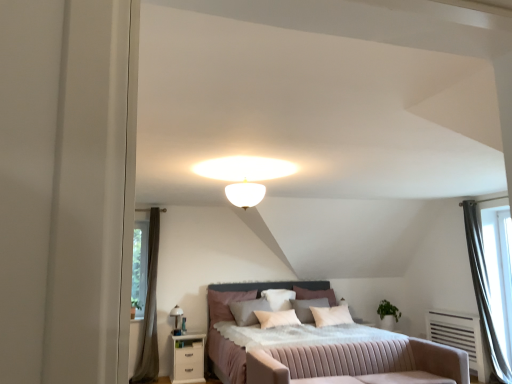
This screenshot has height=384, width=512. What do you see at coordinates (225, 303) in the screenshot?
I see `velvet-like pink pillow at center, the 3th pillow viewed from the right` at bounding box center [225, 303].

Measure the distance between point (177,321) and camera.

5.91 meters.

This screenshot has height=384, width=512. What do you see at coordinates (279, 298) in the screenshot? I see `white soft pillow at center, acting as the 2th pillow starting from the left` at bounding box center [279, 298].

Find the location of a particular element. The image size is (512, 384). soft pink pillow at center, which is the third pillow from left to right is located at coordinates (315, 294).

Which is closer to the camera, (490, 329) or (305, 285)?

The point (490, 329) is more forward.

Do you think silvery metallic curtain at right, which is counted as the second curtain, starting from the left, is within pink fabric bed at center, or outside of it?

The correct answer is: outside.

The height and width of the screenshot is (384, 512). What are the coordinates of `bed below the silvery metallic curtain at right, which is counted as the second curtain, starting from the left (from a real-world perspective)` in the screenshot? It's located at (321, 350).

Is silvery metallic curtain at right, which is counted as the second curtain, starting from the left, aimed at pink fabric bed at center?

Yes, silvery metallic curtain at right, which is counted as the second curtain, starting from the left, faces towards pink fabric bed at center.

Is white soft pillow at center, acting as the 2th pillow starting from the left, not close to pink fabric bed at center?

That's right, there is a large distance between white soft pillow at center, acting as the 2th pillow starting from the left, and pink fabric bed at center.

In the scene shown: Does white soft pillow at center, acting as the 2th pillow starting from the left, appear on the right side of pink fabric bed at center?

No, white soft pillow at center, acting as the 2th pillow starting from the left, is not to the right of pink fabric bed at center.

Based on the photo, does white soft pillow at center, which is counted as the second pillow, starting from the right, have a greater width compared to pink fabric bed at center?

No.

Which of these two, white soft pillow at center, acting as the 2th pillow starting from the left, or white glossy nightstand at lower left, is bigger?

white glossy nightstand at lower left is bigger.

Locate an element on the screen. nightstand below the white soft pillow at center, which is counted as the second pillow, starting from the right (from a real-world perspective) is located at coordinates (187, 359).

In terms of width, does white soft pillow at center, which is counted as the second pillow, starting from the right, look wider or thinner when compared to white glossy nightstand at lower left?

white soft pillow at center, which is counted as the second pillow, starting from the right, is thinner than white glossy nightstand at lower left.

Are soft pink pillow at center, which is the third pillow from left to right, and silvery metallic curtain at right, which is counted as the second curtain, starting from the left, beside each other?

There is a gap between soft pink pillow at center, which is the third pillow from left to right, and silvery metallic curtain at right, which is counted as the second curtain, starting from the left.

From the image's perspective, would you say soft pink pillow at center, which is the third pillow from left to right, is shown under silvery metallic curtain at right, which is the 1th curtain in right-to-left order?

Indeed, from the image's perspective, soft pink pillow at center, which is the third pillow from left to right, is shown beneath silvery metallic curtain at right, which is the 1th curtain in right-to-left order.

Based on the photo, does soft pink pillow at center, which is the third pillow from left to right, turn towards silvery metallic curtain at right, which is the 1th curtain in right-to-left order?

A: No, soft pink pillow at center, which is the third pillow from left to right, does not turn towards silvery metallic curtain at right, which is the 1th curtain in right-to-left order.

Based on the photo, in the image, is soft pink pillow at center, the 1th pillow positioned from the right, on the left side or the right side of silvery metallic curtain at right, which is counted as the second curtain, starting from the left?

soft pink pillow at center, the 1th pillow positioned from the right, is positioned on silvery metallic curtain at right, which is counted as the second curtain, starting from the left,'s left side.

Considering the positions of objects white glossy nightstand at lower left and soft pink pillow at center, the 1th pillow positioned from the right, in the image provided, who is more to the right, white glossy nightstand at lower left or soft pink pillow at center, the 1th pillow positioned from the right,?

Positioned to the right is soft pink pillow at center, the 1th pillow positioned from the right.

From a real-world perspective, is white glossy nightstand at lower left below soft pink pillow at center, the 1th pillow positioned from the right?

Yes.

From the image's perspective, which one is positioned higher, white glossy nightstand at lower left or soft pink pillow at center, the 1th pillow positioned from the right?

soft pink pillow at center, the 1th pillow positioned from the right, is shown above in the image.

Which of these two, brown fabric curtain at left, which is counted as the 2th curtain, starting from the right, or velvet-like pink pillow at center, which is the first pillow from left to right, stands shorter?

With less height is velvet-like pink pillow at center, which is the first pillow from left to right.

From a real-world perspective, is brown fabric curtain at left, which is counted as the 2th curtain, starting from the right, physically below velvet-like pink pillow at center, the 3th pillow viewed from the right?

No.

From the image's perspective, is brown fabric curtain at left, which is counted as the 2th curtain, starting from the right, on velvet-like pink pillow at center, the 3th pillow viewed from the right?

Yes, from the image's perspective, brown fabric curtain at left, which is counted as the 2th curtain, starting from the right, is above velvet-like pink pillow at center, the 3th pillow viewed from the right.

Is brown fabric curtain at left, which is counted as the 2th curtain, starting from the right, turned away from velvet-like pink pillow at center, the 3th pillow viewed from the right?

No, velvet-like pink pillow at center, the 3th pillow viewed from the right, is not at the back of brown fabric curtain at left, which is counted as the 2th curtain, starting from the right.

Considering the relative sizes of soft pink pillow at center, the 1th pillow positioned from the right, and velvet-like pink pillow at center, which is the first pillow from left to right, in the image provided, is soft pink pillow at center, the 1th pillow positioned from the right, bigger than velvet-like pink pillow at center, which is the first pillow from left to right,?

Actually, soft pink pillow at center, the 1th pillow positioned from the right, might be smaller than velvet-like pink pillow at center, which is the first pillow from left to right.

Considering the sizes of soft pink pillow at center, which is the third pillow from left to right, and velvet-like pink pillow at center, which is the first pillow from left to right, in the image, is soft pink pillow at center, which is the third pillow from left to right, wider or thinner than velvet-like pink pillow at center, which is the first pillow from left to right,?

Clearly, soft pink pillow at center, which is the third pillow from left to right, has more width compared to velvet-like pink pillow at center, which is the first pillow from left to right.

Is velvet-like pink pillow at center, which is the first pillow from left to right, located within soft pink pillow at center, the 1th pillow positioned from the right?

That's incorrect, velvet-like pink pillow at center, which is the first pillow from left to right, is not inside soft pink pillow at center, the 1th pillow positioned from the right.

Locate an element on the screen. This screenshot has width=512, height=384. the 2nd curtain above when counting from the pink fabric bed at center (from the image's perspective) is located at coordinates (483, 290).

Which pillow is the 2nd one when counting from the back of the pink fabric bed at center? Please provide its 2D coordinates.

[(279, 298)]

Considering their positions, is brown fabric curtain at left, which is counted as the 2th curtain, starting from the right, positioned closer to matte white table lamp at upper center than white glossy nightstand at lower left?

Among the two, white glossy nightstand at lower left is located nearer to matte white table lamp at upper center.

Estimate the real-world distances between objects in this image. Which object is closer to pink fabric bed at center, white soft pillow at center, which is counted as the second pillow, starting from the right, or matte white table lamp at upper center?

white soft pillow at center, which is counted as the second pillow, starting from the right, lies closer to pink fabric bed at center than the other object.

Which object lies further to the anchor point silvery metallic curtain at right, which is counted as the second curtain, starting from the left, pink fabric swivel chair at center or matte white table lamp at upper center?

matte white table lamp at upper center is further to silvery metallic curtain at right, which is counted as the second curtain, starting from the left.

Which object lies further to the anchor point brown fabric curtain at left, the first curtain in the left-to-right sequence, white glass ceiling light at center or velvet-like pink pillow at center, which is the first pillow from left to right?

white glass ceiling light at center.

Based on their spatial positions, is white soft pillow at center, which is counted as the second pillow, starting from the right, or white glossy nightstand at lower left closer to velvet-like pink pillow at center, the 3th pillow viewed from the right?

white soft pillow at center, which is counted as the second pillow, starting from the right, is positioned closer to the anchor velvet-like pink pillow at center, the 3th pillow viewed from the right.

Looking at the image, which one is located closer to soft pink pillow at center, which is the third pillow from left to right, pink fabric swivel chair at center or brown fabric curtain at left, which is counted as the 2th curtain, starting from the right?

pink fabric swivel chair at center lies closer to soft pink pillow at center, which is the third pillow from left to right, than the other object.

In the scene shown: Considering their positions, is soft pink pillow at center, which is the third pillow from left to right, positioned closer to matte white table lamp at upper center than pink fabric bed at center?

soft pink pillow at center, which is the third pillow from left to right, lies closer to matte white table lamp at upper center than the other object.

Considering their positions, is white soft pillow at center, acting as the 2th pillow starting from the left, positioned further to pink fabric swivel chair at center than velvet-like pink pillow at center, which is the first pillow from left to right?

Among the two, velvet-like pink pillow at center, which is the first pillow from left to right, is located further to pink fabric swivel chair at center.

Identify the location of swivel chair between matte white table lamp at upper center and silvery metallic curtain at right, which is counted as the second curtain, starting from the left, in the horizontal direction. (358, 363).

This screenshot has width=512, height=384. What are the coordinates of `lighting between white glossy nightstand at lower left and silvery metallic curtain at right, which is the 1th curtain in right-to-left order, in the horizontal direction` in the screenshot? It's located at (245, 194).

Where is `lighting between pink fabric swivel chair at center and matte white table lamp at upper center in the front-back direction`? This screenshot has width=512, height=384. lighting between pink fabric swivel chair at center and matte white table lamp at upper center in the front-back direction is located at coordinates (245, 194).

Image resolution: width=512 pixels, height=384 pixels. Identify the location of bed positioned between pink fabric swivel chair at center and white glossy nightstand at lower left from near to far. (321, 350).